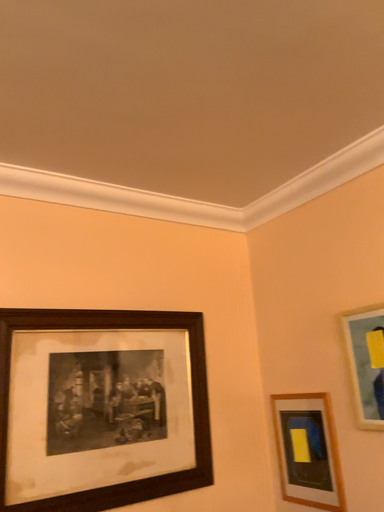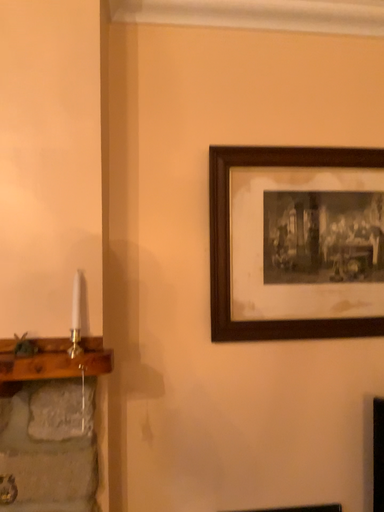
Question: Which way did the camera rotate in the video?

Choices:
 (A) rotated right
 (B) rotated left

Answer: (B)